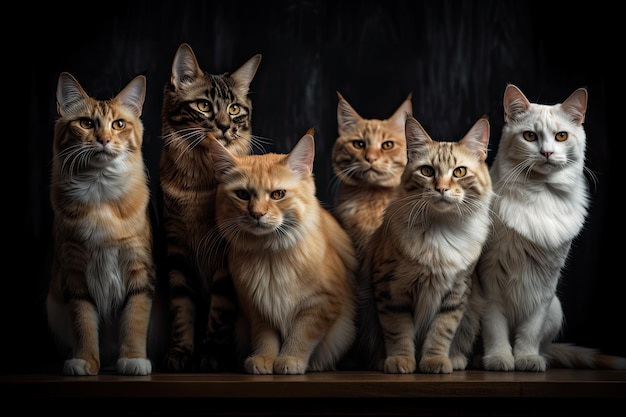
This screenshot has height=417, width=626. In order to click on chests in this screenshot , I will do `click(110, 240)`, `click(201, 214)`, `click(273, 290)`, `click(366, 228)`, `click(436, 257)`, `click(550, 232)`.